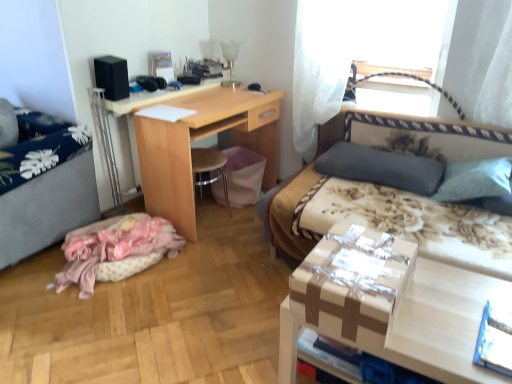
Question: Is gray fabric hospital bed at left bigger than black matte speaker at upper left?

Choices:
 (A) yes
 (B) no

Answer: (A)

Question: Is gray fabric hospital bed at left smaller than black matte speaker at upper left?

Choices:
 (A) no
 (B) yes

Answer: (A)

Question: Does gray fabric hospital bed at left have a lesser height compared to black matte speaker at upper left?

Choices:
 (A) yes
 (B) no

Answer: (B)

Question: Does gray fabric hospital bed at left have a greater height compared to black matte speaker at upper left?

Choices:
 (A) no
 (B) yes

Answer: (B)

Question: Would you say gray fabric hospital bed at left contains black matte speaker at upper left?

Choices:
 (A) no
 (B) yes

Answer: (A)

Question: From the image's perspective, is gray fabric hospital bed at left below black matte speaker at upper left?

Choices:
 (A) yes
 (B) no

Answer: (A)

Question: Can you confirm if pink fabric at lower left is smaller than matte cardboard box at lower right?

Choices:
 (A) no
 (B) yes

Answer: (B)

Question: Is pink fabric at lower left oriented towards matte cardboard box at lower right?

Choices:
 (A) no
 (B) yes

Answer: (B)

Question: Considering the relative sizes of pink fabric at lower left and matte cardboard box at lower right in the image provided, is pink fabric at lower left thinner than matte cardboard box at lower right?

Choices:
 (A) no
 (B) yes

Answer: (A)

Question: From a real-world perspective, is pink fabric at lower left located beneath matte cardboard box at lower right?

Choices:
 (A) yes
 (B) no

Answer: (A)

Question: Is the position of pink fabric at lower left more distant than that of matte cardboard box at lower right?

Choices:
 (A) yes
 (B) no

Answer: (A)

Question: Is pink fabric at lower left shorter than matte cardboard box at lower right?

Choices:
 (A) no
 (B) yes

Answer: (B)

Question: From the image's perspective, is floral fabric bed at right located beneath black matte speaker at upper left?

Choices:
 (A) no
 (B) yes

Answer: (B)